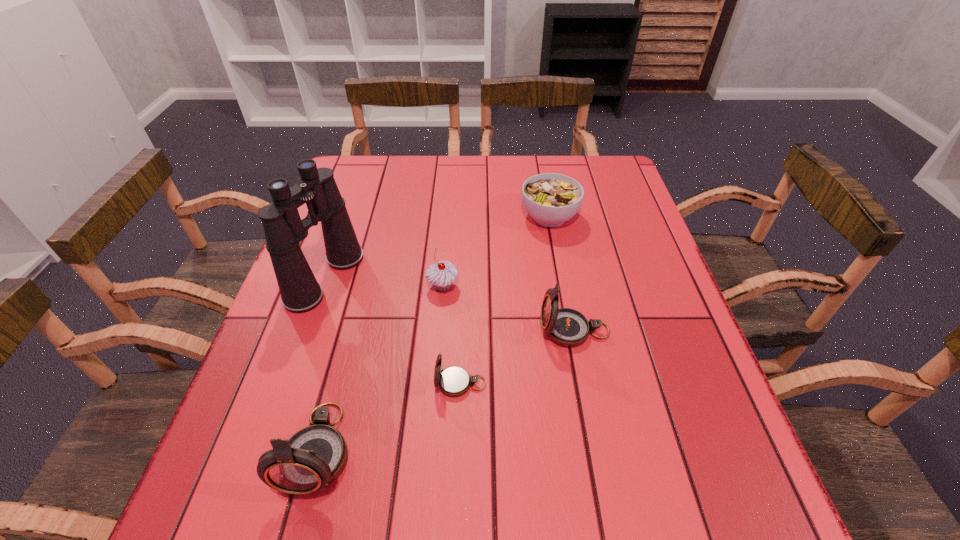
Locate an element on the screen. Image resolution: width=960 pixels, height=540 pixels. binoculars at the left edge is located at coordinates coord(300,292).

Image resolution: width=960 pixels, height=540 pixels. I want to click on object that is at the near left corner, so click(x=313, y=457).

Locate an element on the screen. free location at the far edge is located at coordinates (482, 190).

In the image, there is a desktop. Where is `vacant space at the near edge`? The width and height of the screenshot is (960, 540). vacant space at the near edge is located at coordinates (579, 432).

I want to click on free space at the left edge, so click(259, 407).

Identify the location of vacant space at the right edge of the desktop. click(x=717, y=407).

The width and height of the screenshot is (960, 540). In the image, there is a desktop. In order to click on free space at the near left corner in this screenshot , I will do coord(237,422).

I want to click on free space at the far right corner, so click(x=607, y=188).

Where is `vacant space at the near right corner of the desktop`? vacant space at the near right corner of the desktop is located at coordinates (716, 417).

Where is `vacant space in between the soup bowl and the binoculars`? Image resolution: width=960 pixels, height=540 pixels. vacant space in between the soup bowl and the binoculars is located at coordinates (438, 247).